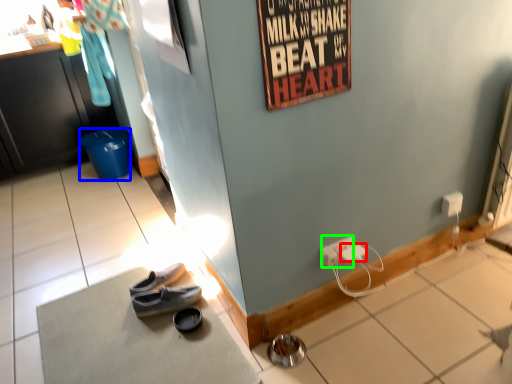
Question: Estimate the real-world distances between objects in this image. Which object is closer to power outlet (highlighted by a red box), trash bin/can (highlighted by a blue box) or power outlet (highlighted by a green box)?

Choices:
 (A) trash bin/can
 (B) power outlet

Answer: (B)